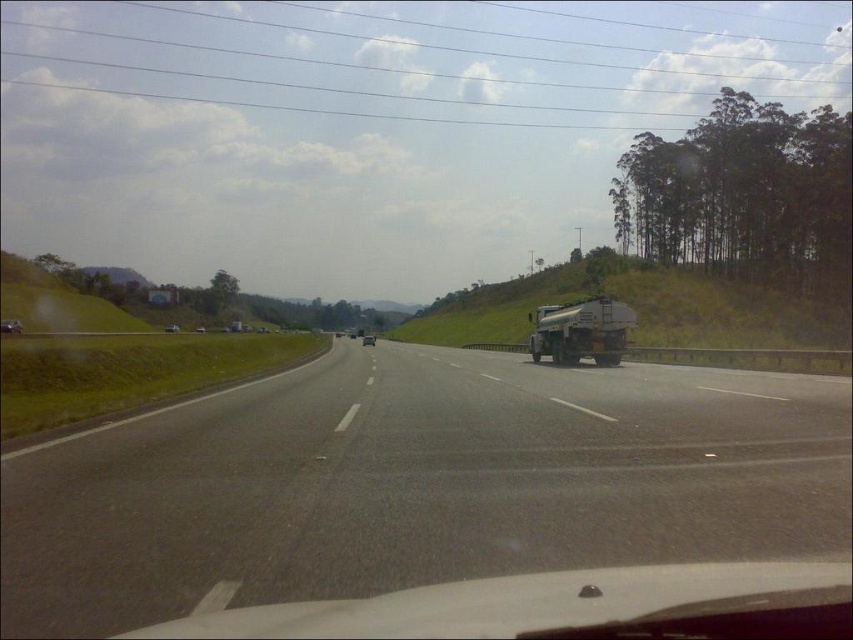
Question: Can you confirm if shiny silver sedan at left is positioned below shiny silver sedan at center?

Choices:
 (A) no
 (B) yes

Answer: (A)

Question: Among these objects, which one is nearest to the camera?

Choices:
 (A) black asphalt highway at center
 (B) green grassy hill at right
 (C) shiny silver sedan at left
 (D) metallic silver tanker at right

Answer: (A)

Question: Which object appears closest to the camera in this image?

Choices:
 (A) shiny silver sedan at left
 (B) black asphalt highway at center

Answer: (B)

Question: Which point is closer to the camera taking this photo?

Choices:
 (A) (840, 342)
 (B) (699, 458)
 (C) (6, 321)

Answer: (B)

Question: Can you confirm if black asphalt highway at center is positioned below shiny silver sedan at left?

Choices:
 (A) no
 (B) yes

Answer: (B)

Question: Does metallic silver tanker at right appear on the left side of shiny silver sedan at center?

Choices:
 (A) no
 (B) yes

Answer: (A)